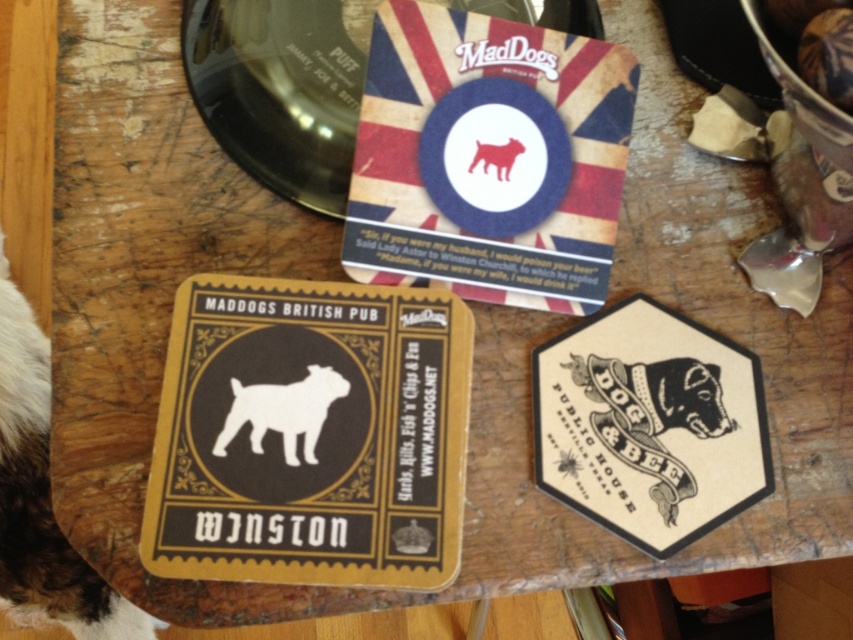
In the scene shown: Can you confirm if matte black coaster at center is smaller than matte paper coaster at center?

Incorrect, matte black coaster at center is not smaller in size than matte paper coaster at center.

Can you confirm if matte black coaster at center is positioned below matte paper coaster at center?

Yes, matte black coaster at center is below matte paper coaster at center.

Between point (216, 285) and point (415, 4), which one is positioned in front?

Positioned in front is point (216, 285).

The width and height of the screenshot is (853, 640). In order to click on matte black coaster at center in this screenshot , I will do `click(310, 435)`.

Based on the photo, who is higher up, matte black coaster at center or white paper hexagon at lower right?

matte black coaster at center

Is matte black coaster at center bigger than white paper hexagon at lower right?

Indeed, matte black coaster at center has a larger size compared to white paper hexagon at lower right.

Based on the photo, who is more forward, [167,378] or [590,321]?

Point [167,378] is in front.

Find the location of a particular element. The image size is (853, 640). matte black coaster at center is located at coordinates (310, 435).

Between matte paper coaster at center and matte white dog at center, which one appears on the right side from the viewer's perspective?

matte white dog at center is more to the right.

Does matte paper coaster at center have a greater height compared to matte white dog at center?

Indeed, matte paper coaster at center has a greater height compared to matte white dog at center.

The height and width of the screenshot is (640, 853). In order to click on matte paper coaster at center in this screenshot , I will do `click(489, 166)`.